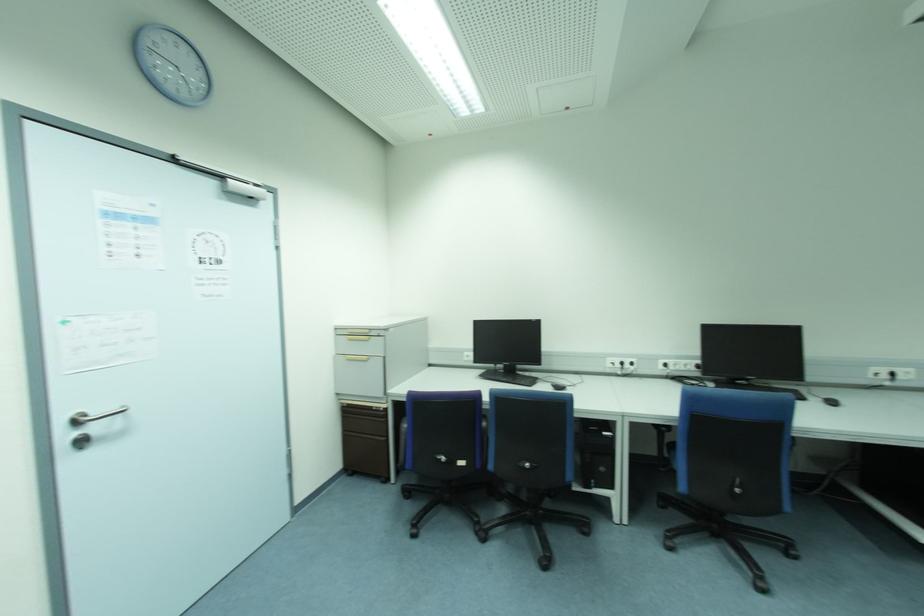
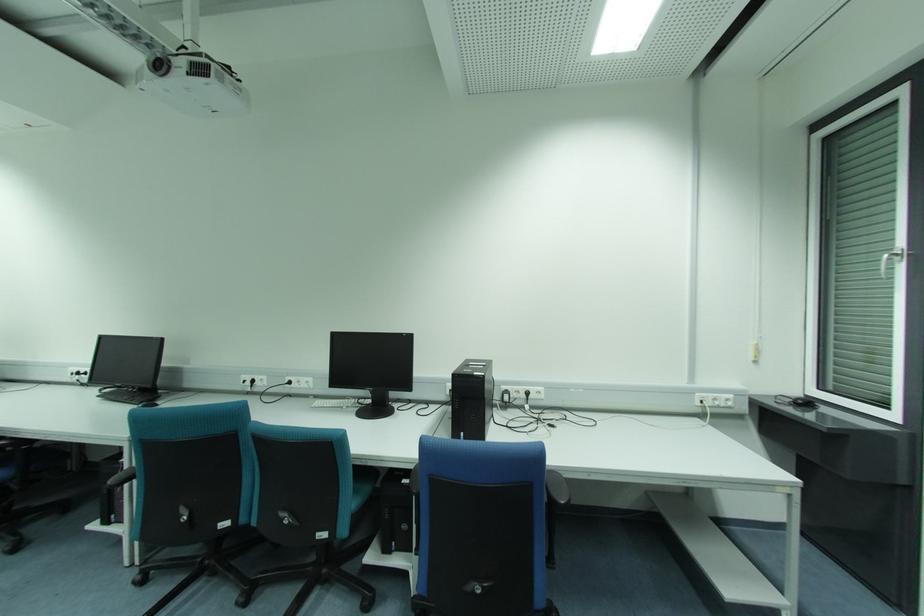
Where in the second image is the point corresponding to (892,375) from the first image?

(253, 381)